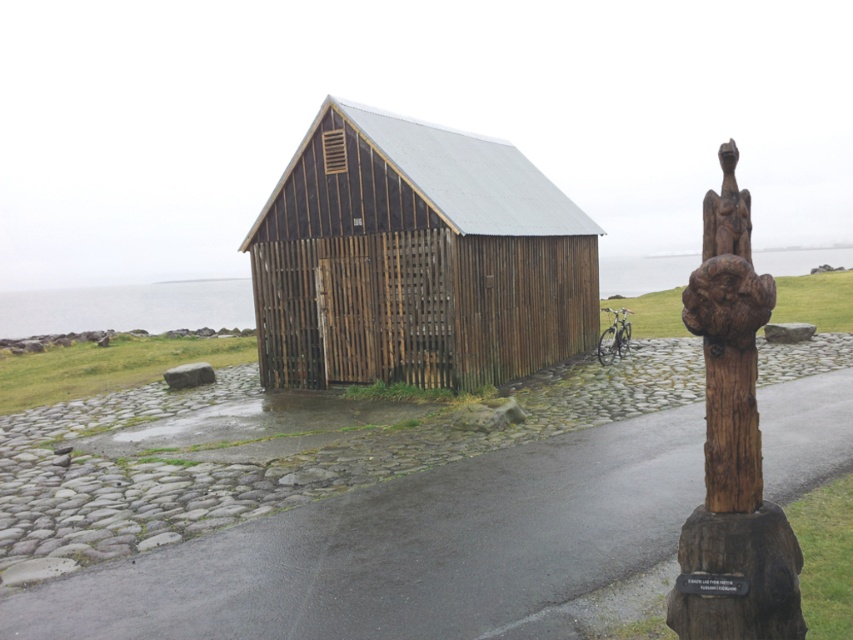
Question: Based on their relative distances, which object is nearer to the dark brown wooden barn at center?

Choices:
 (A) carved wooden totem pole at right
 (B) brown wooden carving at upper right

Answer: (B)

Question: Can you confirm if dark brown wooden barn at center is smaller than carved wooden totem pole at right?

Choices:
 (A) yes
 (B) no

Answer: (B)

Question: Considering the relative positions of dark brown wooden barn at center and carved wooden totem pole at right in the image provided, where is dark brown wooden barn at center located with respect to carved wooden totem pole at right?

Choices:
 (A) below
 (B) above

Answer: (B)

Question: Which object appears farthest from the camera in this image?

Choices:
 (A) dark brown wooden barn at center
 (B) carved wooden totem pole at right
 (C) brown wooden carving at upper right

Answer: (A)

Question: Among these objects, which one is nearest to the camera?

Choices:
 (A) brown wooden carving at upper right
 (B) dark brown wooden barn at center
 (C) carved wooden totem pole at right

Answer: (C)

Question: From the image, what is the correct spatial relationship of dark brown wooden barn at center in relation to carved wooden totem pole at right?

Choices:
 (A) left
 (B) right

Answer: (A)